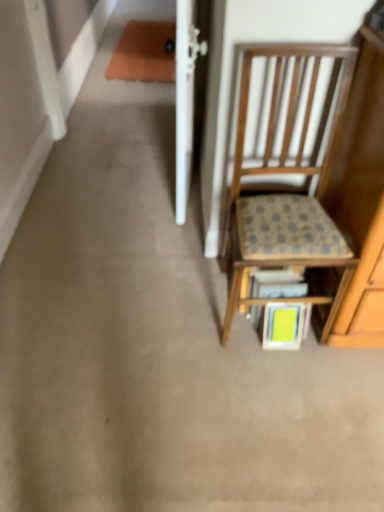
Question: From a real-world perspective, is green matte book at lower center above or below wooden textured shelf at center?

Choices:
 (A) below
 (B) above

Answer: (A)

Question: Considering the positions of point [x=286, y=309] and point [x=254, y=298], is point [x=286, y=309] closer or farther from the camera than point [x=254, y=298]?

Choices:
 (A) closer
 (B) farther

Answer: (A)

Question: Based on their relative distances, which object is farther from the green matte book at lower center?

Choices:
 (A) wooden chair with cushion at right
 (B) wooden textured shelf at center

Answer: (A)

Question: Which of these objects is positioned closest to the green matte book at lower center?

Choices:
 (A) wooden chair with cushion at right
 (B) wooden textured shelf at center

Answer: (B)